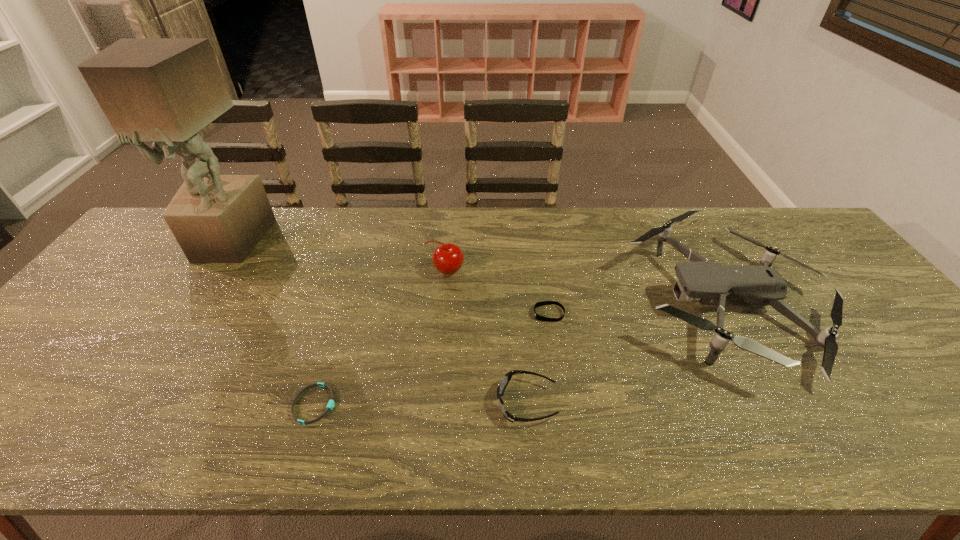
Image resolution: width=960 pixels, height=540 pixels. In order to click on free space located on the buckle of the shorter wristband in this screenshot , I will do `click(508, 404)`.

Locate an element on the screen. The height and width of the screenshot is (540, 960). sculpture that is at the far edge is located at coordinates (163, 90).

You are a GUI agent. You are given a task and a screenshot of the screen. Output one action in this format:
    pyautogui.click(x=<x>, y=<y>)
    Task: Click on the drone at the far edge
    Image resolution: width=960 pixels, height=540 pixels.
    Given the screenshot: What is the action you would take?
    pyautogui.click(x=711, y=284)

At what (x,y) coordinates should I click in order to perform the action: click on sunglasses at the near edge. Please return your answer as a coordinate pair (x, y). Looking at the image, I should click on (507, 377).

Locate an element on the screen. The image size is (960, 540). wristband located in the near edge section of the desktop is located at coordinates (331, 403).

I want to click on object present at the right edge, so click(x=711, y=284).

Find the location of a particular element. This screenshot has width=960, height=540. object located at the far right corner is located at coordinates (711, 284).

In the image, there is a desktop. In order to click on vacant space at the far edge in this screenshot , I will do `click(482, 253)`.

You are a GUI agent. You are given a task and a screenshot of the screen. Output one action in this format:
    pyautogui.click(x=<x>, y=<y>)
    Task: Click on the vacant space at the near edge of the desktop
    The width and height of the screenshot is (960, 540).
    Given the screenshot: What is the action you would take?
    268,421

In the image, there is a desktop. Where is `vacant space at the left edge`? Image resolution: width=960 pixels, height=540 pixels. vacant space at the left edge is located at coordinates (102, 285).